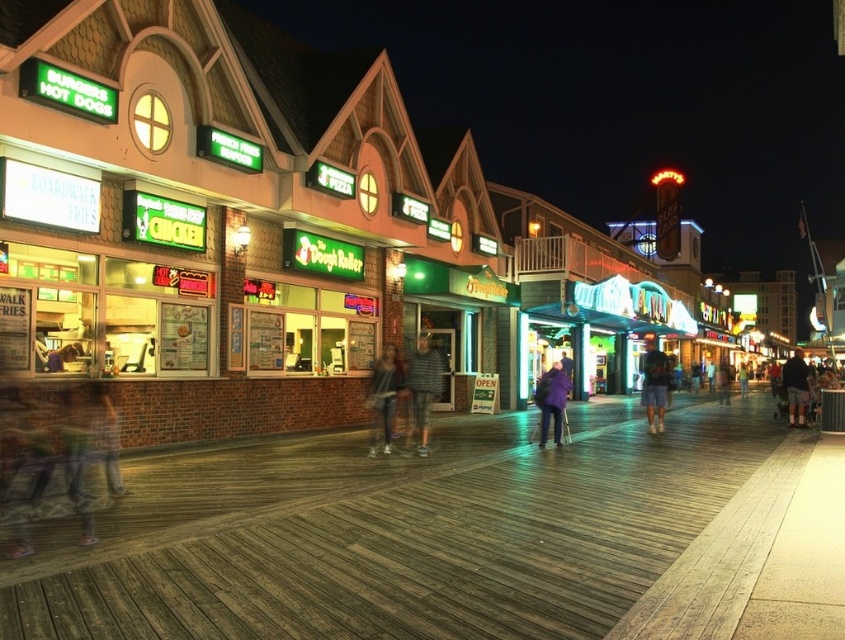
Question: Does striped sweater at center appear on the left side of denim jacket at center?

Choices:
 (A) yes
 (B) no

Answer: (B)

Question: Based on their relative distances, which object is farther from the dark blue shorts at center?

Choices:
 (A) purple fabric coat at center
 (B) denim jacket at center

Answer: (B)

Question: Estimate the real-world distances between objects in this image. Which object is closer to the dark blue shorts at center?

Choices:
 (A) dark gray shorts at right
 (B) striped sweater at center

Answer: (B)

Question: Considering the real-world distances, which object is closest to the dark gray shorts at right?

Choices:
 (A) dark blue shorts at center
 (B) striped sweater at center
 (C) denim jacket at center
 (D) purple fabric coat at center

Answer: (D)

Question: Can you confirm if striped sweater at center is positioned to the left of denim jacket at center?

Choices:
 (A) no
 (B) yes

Answer: (A)

Question: Does striped sweater at center appear on the left side of dark gray shorts at right?

Choices:
 (A) no
 (B) yes

Answer: (B)